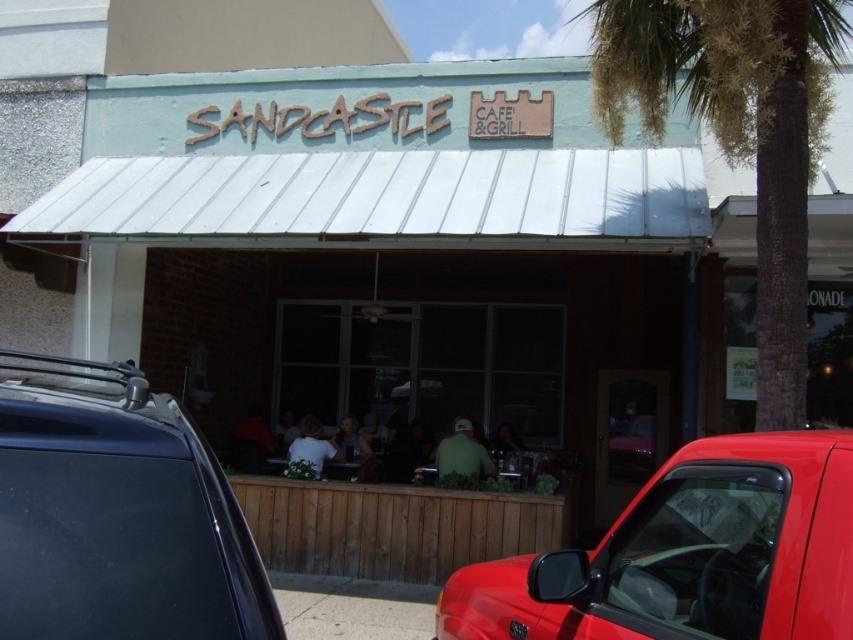
Question: Does shiny red truck at lower right have a greater width compared to green leafy palm tree at upper right?

Choices:
 (A) no
 (B) yes

Answer: (A)

Question: Among these objects, which one is farthest from the camera?

Choices:
 (A) green leafy palm tree at upper right
 (B) matte black car at center
 (C) shiny red truck at lower right

Answer: (A)

Question: Is shiny red truck at lower right positioned before green leafy palm tree at upper right?

Choices:
 (A) no
 (B) yes

Answer: (B)

Question: Which object is farther from the camera taking this photo?

Choices:
 (A) matte black car at center
 (B) green leafy palm tree at upper right
 (C) shiny red truck at lower right

Answer: (B)

Question: Among these points, which one is nearest to the camera?

Choices:
 (A) (828, 624)
 (B) (735, 157)
 (C) (74, 563)

Answer: (C)

Question: Does matte black car at center appear over shiny red truck at lower right?

Choices:
 (A) no
 (B) yes

Answer: (B)